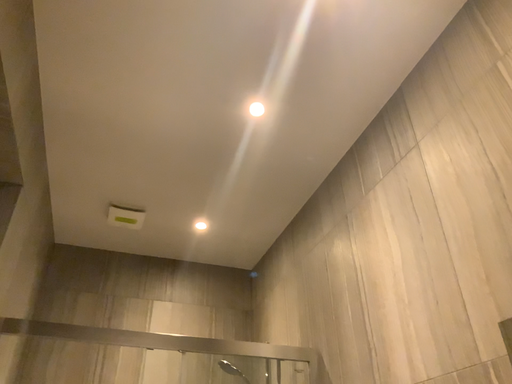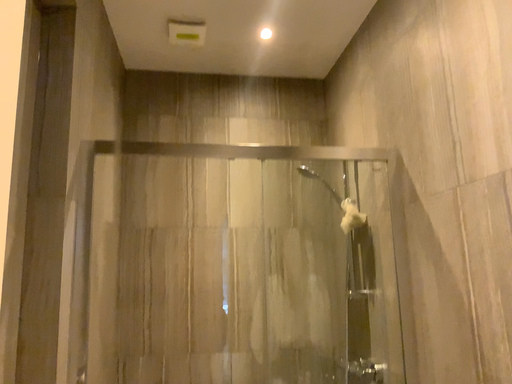
Question: How did the camera likely rotate when shooting the video?

Choices:
 (A) rotated left
 (B) rotated right

Answer: (A)